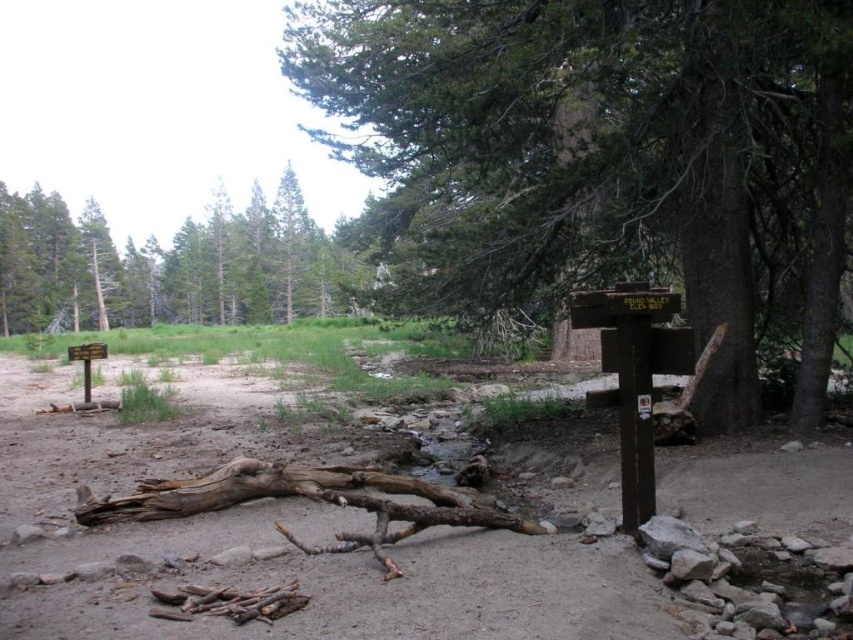
Does smooth brown tree trunk at center have a greater height compared to brown dirt track at center?

Yes.

Can you confirm if smooth brown tree trunk at center is positioned to the right of brown dirt track at center?

Indeed, smooth brown tree trunk at center is positioned on the right side of brown dirt track at center.

Who is more forward, [809,20] or [0,604]?

Point [0,604] is in front.

I want to click on smooth brown tree trunk at center, so click(605, 154).

Is smooth brown tree trunk at center taller than green leafy tree at upper left?

No, smooth brown tree trunk at center is not taller than green leafy tree at upper left.

Is smooth brown tree trunk at center below green leafy tree at upper left?

Indeed, smooth brown tree trunk at center is positioned under green leafy tree at upper left.

Is point (442, 166) farther from camera compared to point (38, 259)?

No, it is not.

The image size is (853, 640). What are the coordinates of `smooth brown tree trunk at center` in the screenshot? It's located at (605, 154).

Who is shorter, brown dirt track at center or green leafy tree at upper left?

With less height is brown dirt track at center.

Is brown dirt track at center shorter than green leafy tree at upper left?

Yes, brown dirt track at center is shorter than green leafy tree at upper left.

The image size is (853, 640). Identify the location of brown dirt track at center. (277, 540).